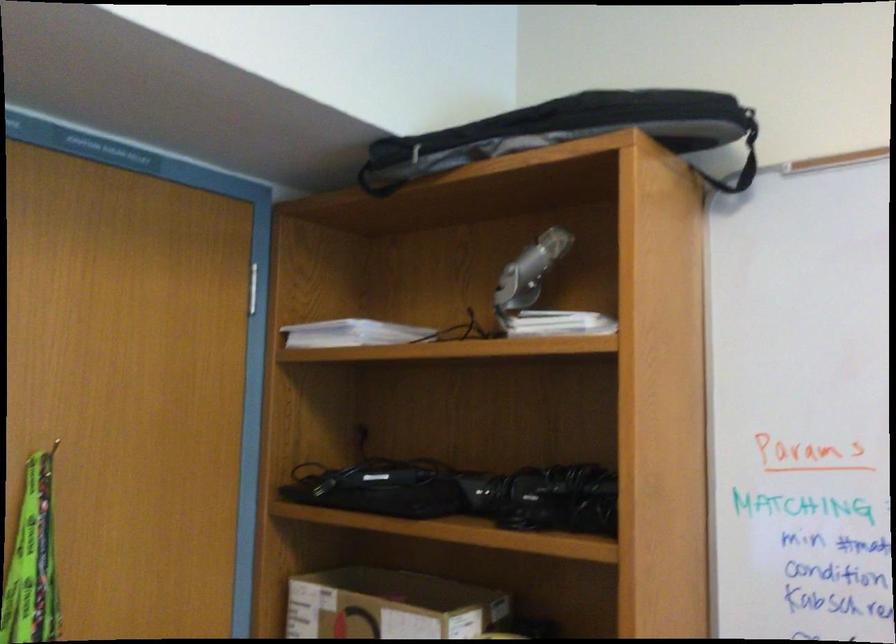
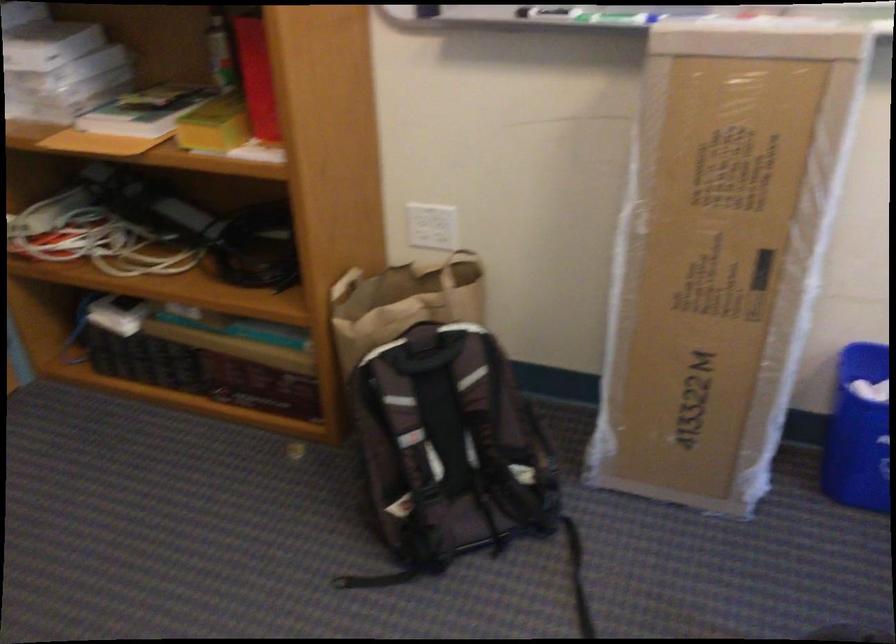
First-person continuous shooting, in which direction is the camera rotating?

The camera's rotation is toward right-down.